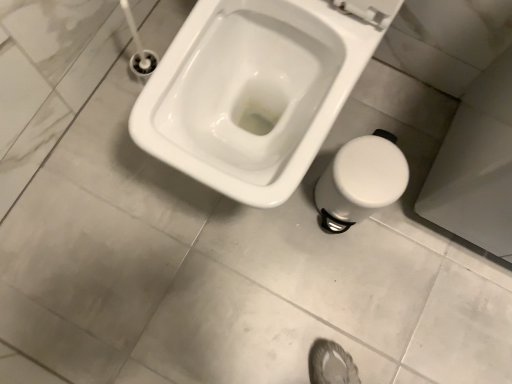
Locate an element on the screen. This screenshot has height=384, width=512. vacant region to the left of white plastic bidet at lower right is located at coordinates (272, 219).